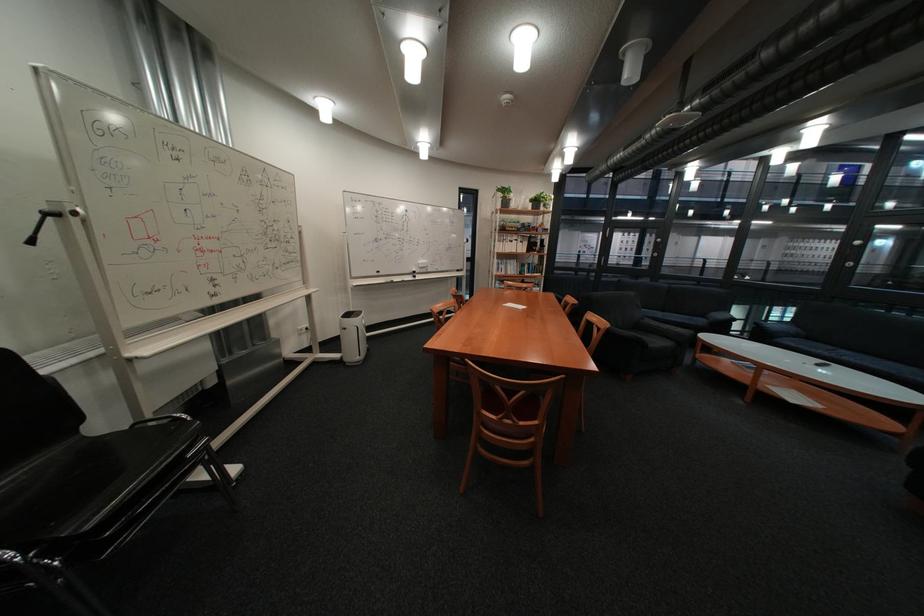
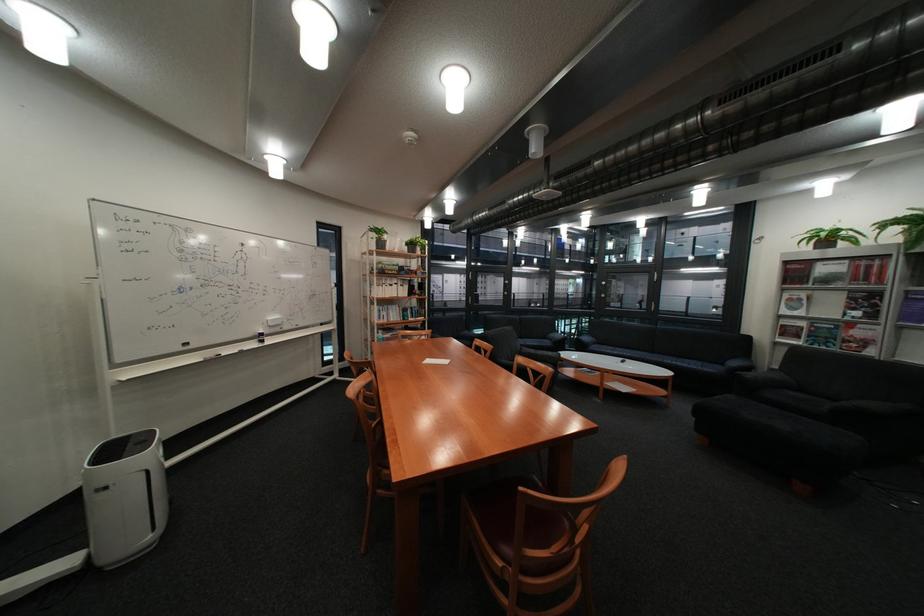
The point at (360,329) is marked in the first image. Where is the corresponding point in the second image?

(120, 488)